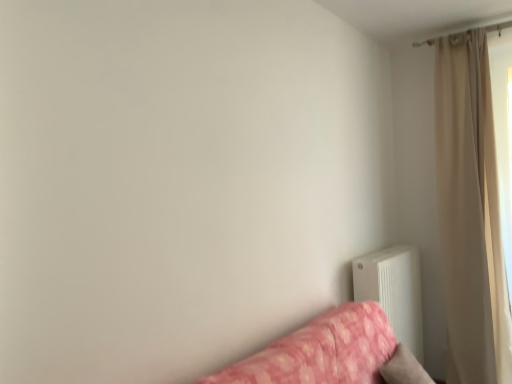
You are a GUI agent. You are given a task and a screenshot of the screen. Output one action in this format:
    pyautogui.click(x=<x>, y=<y>)
    Task: Click on the pink floral fabric studio couch at lower right
    
    Given the screenshot: What is the action you would take?
    pyautogui.click(x=322, y=351)

At what (x,y) coordinates should I click in order to perform the action: click on beige fabric curtain at upper right. Please return your answer as a coordinate pair (x, y). Image resolution: width=512 pixels, height=384 pixels. Looking at the image, I should click on (470, 214).

Find the location of a particular element. white matte radiator at lower right is located at coordinates (394, 291).

Image resolution: width=512 pixels, height=384 pixels. In order to click on pink floral fabric studio couch at lower right in this screenshot , I will do `click(322, 351)`.

Relative to beige fabric curtain at upper right, is pink floral fabric studio couch at lower right in front or behind?

pink floral fabric studio couch at lower right is in front of beige fabric curtain at upper right.

From the picture: In the image, is pink floral fabric studio couch at lower right on the left side or the right side of beige fabric curtain at upper right?

pink floral fabric studio couch at lower right is to the left of beige fabric curtain at upper right.

Image resolution: width=512 pixels, height=384 pixels. I want to click on curtain on the right of pink floral fabric studio couch at lower right, so click(x=470, y=214).

Is point (298, 367) more distant than point (501, 313)?

No, it is in front of (501, 313).

What's the angular difference between white matte radiator at lower right and pink floral fabric studio couch at lower right's facing directions?

The angular difference between white matte radiator at lower right and pink floral fabric studio couch at lower right is 0.487 degrees.

Is white matte radiator at lower right in contact with pink floral fabric studio couch at lower right?

white matte radiator at lower right and pink floral fabric studio couch at lower right are not in contact.

Based on the photo, is white matte radiator at lower right positioned beyond the bounds of pink floral fabric studio couch at lower right?

Yes, white matte radiator at lower right is outside of pink floral fabric studio couch at lower right.

Measure the distance from white matte radiator at lower right to pink floral fabric studio couch at lower right.

The distance of white matte radiator at lower right from pink floral fabric studio couch at lower right is 65.48 centimeters.

Is beige fabric curtain at upper right far from white matte radiator at lower right?

They are positioned close to each other.

Who is taller, beige fabric curtain at upper right or white matte radiator at lower right?

beige fabric curtain at upper right is taller.

How far apart are beige fabric curtain at upper right and white matte radiator at lower right?

The distance of beige fabric curtain at upper right from white matte radiator at lower right is 21.77 inches.

Does beige fabric curtain at upper right come behind white matte radiator at lower right?

Yes.

Considering the positions of objects white matte radiator at lower right and beige fabric curtain at upper right in the image provided, who is more to the left, white matte radiator at lower right or beige fabric curtain at upper right?

white matte radiator at lower right is more to the left.

Is white matte radiator at lower right surrounding beige fabric curtain at upper right?

A: Definitely not — beige fabric curtain at upper right is not inside white matte radiator at lower right.

Does white matte radiator at lower right turn towards beige fabric curtain at upper right?

No.

Does white matte radiator at lower right have a greater width compared to beige fabric curtain at upper right?

No.

Considering the relative sizes of pink floral fabric studio couch at lower right and white matte radiator at lower right in the image provided, is pink floral fabric studio couch at lower right shorter than white matte radiator at lower right?

Yes.

Is pink floral fabric studio couch at lower right positioned far away from white matte radiator at lower right?

No, there isn't a large distance between pink floral fabric studio couch at lower right and white matte radiator at lower right.

Can you confirm if pink floral fabric studio couch at lower right is bigger than white matte radiator at lower right?

Correct, pink floral fabric studio couch at lower right is larger in size than white matte radiator at lower right.

Considering the positions of objects pink floral fabric studio couch at lower right and white matte radiator at lower right in the image provided, who is more to the right, pink floral fabric studio couch at lower right or white matte radiator at lower right?

white matte radiator at lower right.

Considering the sizes of objects beige fabric curtain at upper right and pink floral fabric studio couch at lower right in the image provided, who is shorter, beige fabric curtain at upper right or pink floral fabric studio couch at lower right?

Standing shorter between the two is pink floral fabric studio couch at lower right.

Is the surface of beige fabric curtain at upper right in direct contact with pink floral fabric studio couch at lower right?

beige fabric curtain at upper right and pink floral fabric studio couch at lower right are clearly separated.

Is point (496, 307) positioned in front of point (383, 362)?

No.

This screenshot has width=512, height=384. Identify the location of studio couch on the left of the beige fabric curtain at upper right. (322, 351).

At what (x,y) coordinates should I click in order to perform the action: click on radiator located above the pink floral fabric studio couch at lower right (from the image's perspective). Please return your answer as a coordinate pair (x, y). This screenshot has height=384, width=512. Looking at the image, I should click on (394, 291).

Which object lies further to the anchor point beige fabric curtain at upper right, white matte radiator at lower right or pink floral fabric studio couch at lower right?

pink floral fabric studio couch at lower right.

Which object lies nearer to the anchor point white matte radiator at lower right, pink floral fabric studio couch at lower right or beige fabric curtain at upper right?

beige fabric curtain at upper right is positioned closer to the anchor white matte radiator at lower right.

Estimate the real-world distances between objects in this image. Which object is further from beige fabric curtain at upper right, pink floral fabric studio couch at lower right or white matte radiator at lower right?

pink floral fabric studio couch at lower right.

Based on their spatial positions, is white matte radiator at lower right or beige fabric curtain at upper right closer to pink floral fabric studio couch at lower right?

white matte radiator at lower right lies closer to pink floral fabric studio couch at lower right than the other object.

When comparing their distances from pink floral fabric studio couch at lower right, does beige fabric curtain at upper right or white matte radiator at lower right seem further?

beige fabric curtain at upper right lies further to pink floral fabric studio couch at lower right than the other object.

Considering their positions, is beige fabric curtain at upper right positioned further to white matte radiator at lower right than pink floral fabric studio couch at lower right?

The object further to white matte radiator at lower right is pink floral fabric studio couch at lower right.

You are a GUI agent. You are given a task and a screenshot of the screen. Output one action in this format:
    pyautogui.click(x=<x>, y=<y>)
    Task: Click on the radiator between pink floral fabric studio couch at lower right and beige fabric curtain at upper right along the z-axis
    
    Given the screenshot: What is the action you would take?
    pyautogui.click(x=394, y=291)